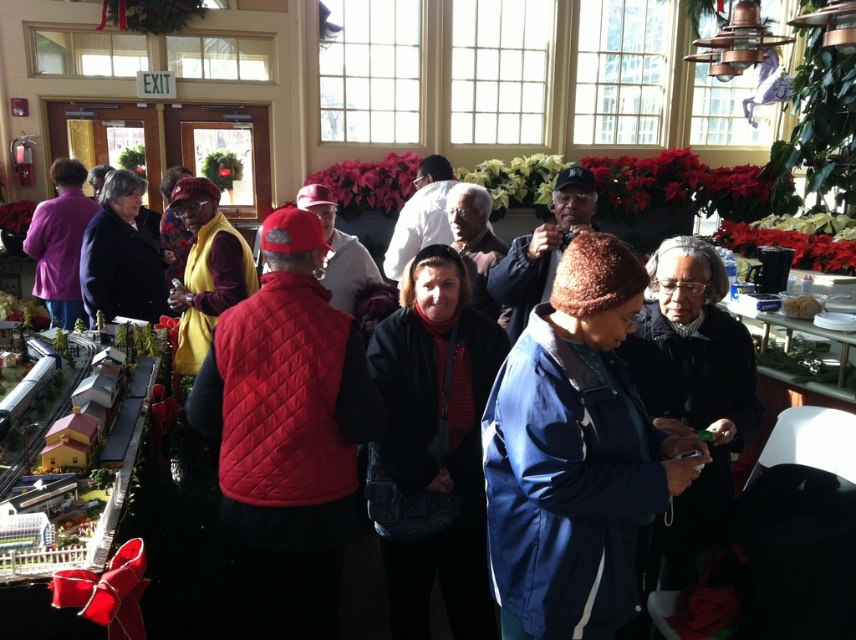
Which is behind, point (66, 168) or point (791, 305)?

Point (66, 168)

Who is higher up, matte purple jacket at left or white fluffy bread at center?

matte purple jacket at left is above.

What do you see at coordinates (60, 243) in the screenshot? I see `matte purple jacket at left` at bounding box center [60, 243].

The width and height of the screenshot is (856, 640). Identify the location of matte purple jacket at left. pyautogui.click(x=60, y=243).